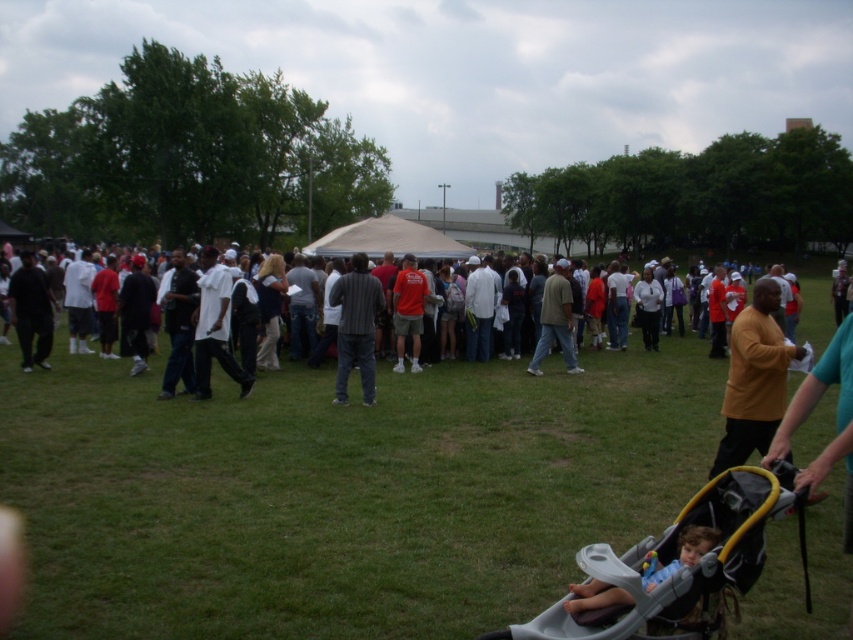
Question: Is white cotton crowd at center thinner than white matte shirt at center?

Choices:
 (A) yes
 (B) no

Answer: (B)

Question: Which point is farther to the camera?

Choices:
 (A) coord(349,301)
 (B) coord(642,637)

Answer: (A)

Question: Estimate the real-world distances between objects in this image. Which object is farther from the gray cotton shirt at center?

Choices:
 (A) dark gray hoodie at center
 (B) light brown plush stroller at lower right
 (C) white cotton shirt at left

Answer: (B)

Question: Does matte yellow shirt at center come in front of matte black pants at left?

Choices:
 (A) yes
 (B) no

Answer: (A)

Question: Is green grass at center bigger than white cotton shirt at left?

Choices:
 (A) yes
 (B) no

Answer: (B)

Question: Among these objects, which one is nearest to the camera?

Choices:
 (A) white cotton crowd at center
 (B) green grass at center

Answer: (B)